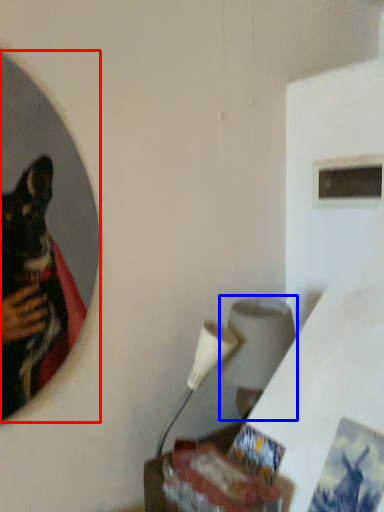
Question: Among these objects, which one is farthest to the camera, mirror (highlighted by a red box) or lamp (highlighted by a blue box)?

Choices:
 (A) mirror
 (B) lamp

Answer: (B)